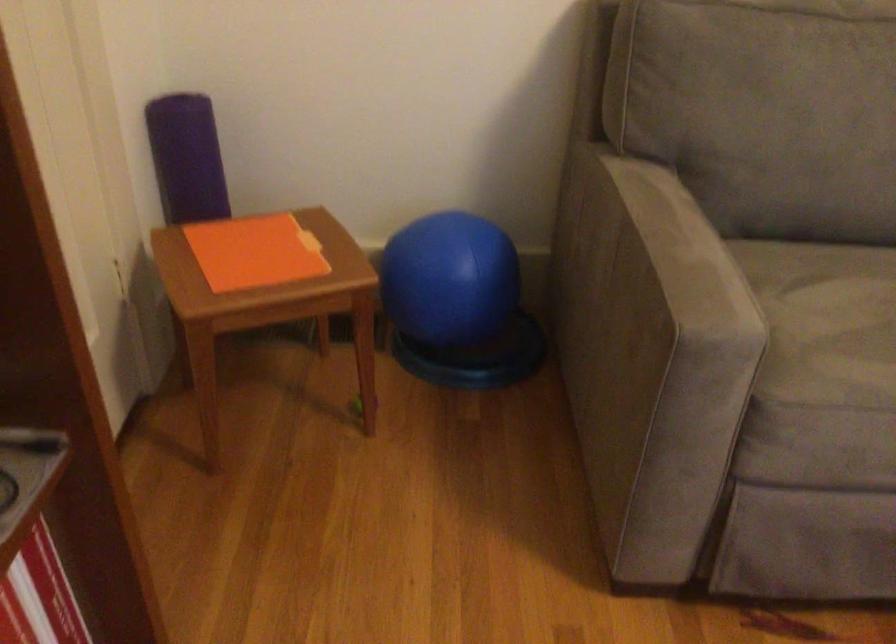
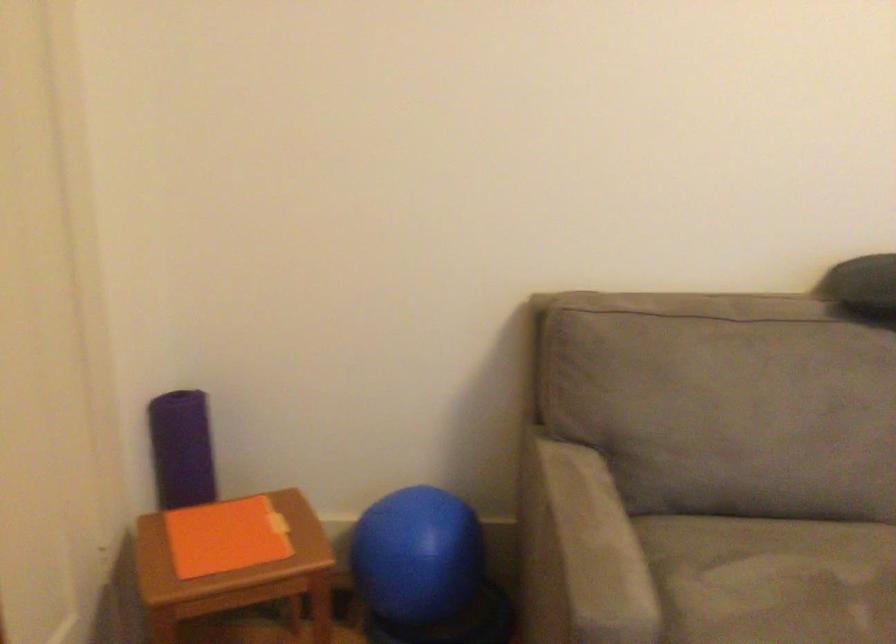
Where in the second image is the point corresponding to (x=684, y=261) from the first image?

(588, 550)